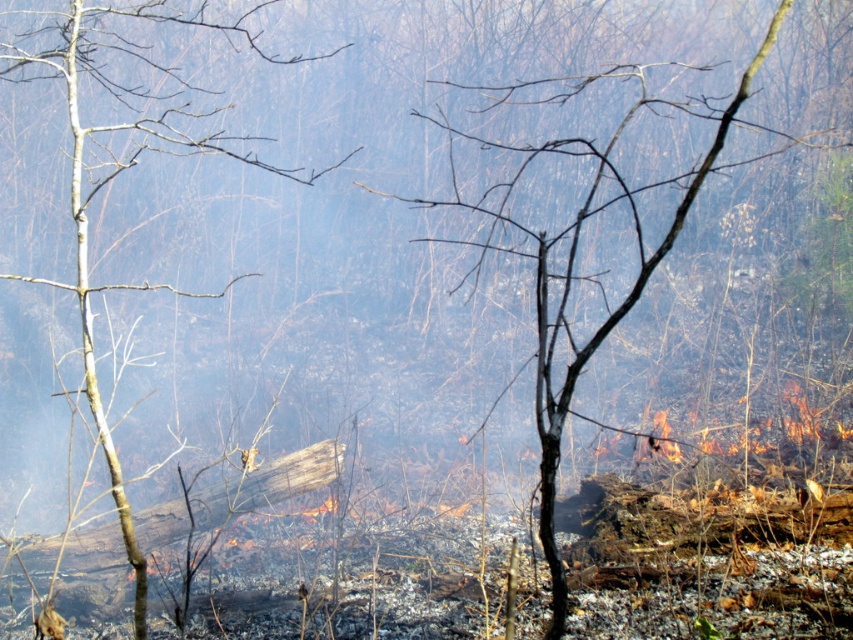
This screenshot has width=853, height=640. What do you see at coordinates (111, 179) in the screenshot?
I see `brown bark tree at left` at bounding box center [111, 179].

From the picture: Is brown bark tree at left taller than brown bark tree at center?

Yes, brown bark tree at left is taller than brown bark tree at center.

Describe the element at coordinates (111, 179) in the screenshot. I see `brown bark tree at left` at that location.

This screenshot has width=853, height=640. Identify the location of brown bark tree at left. (111, 179).